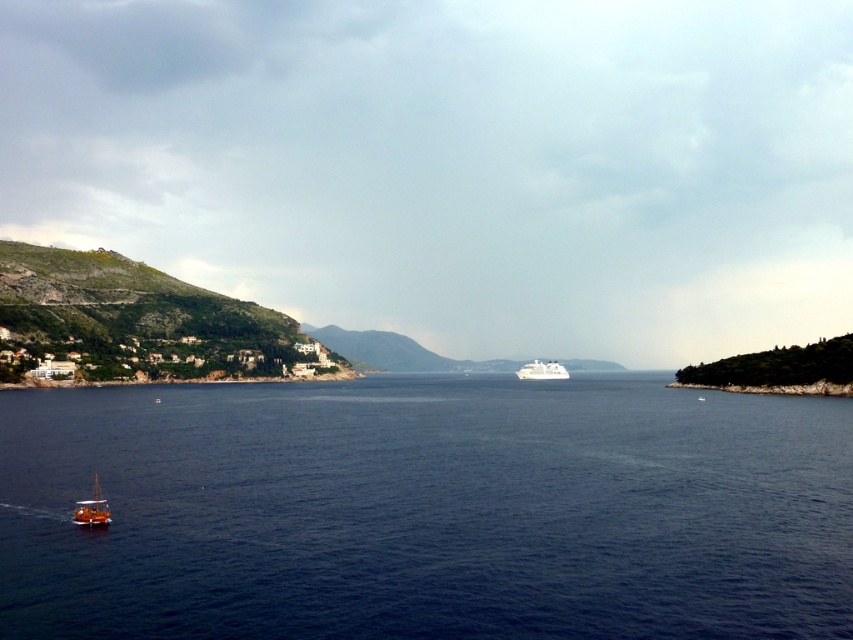
You are a photographer planning to capture the wooden sailboat at lower left and the white glossy cruise ship at center in the same frame. Based on their positions, which one would appear closer to the top of the photo?

The wooden sailboat at lower left appears closer to the top of the photo because it is positioned above the white glossy cruise ship at center.

Looking at this image, you are standing on the shore and see the blue water at lower left and the wooden sailboat at lower left. Which object is closer to your right side?

The blue water at lower left is positioned on the right side of the wooden sailboat at lower left, so the blue water at lower left is closer to your right side.